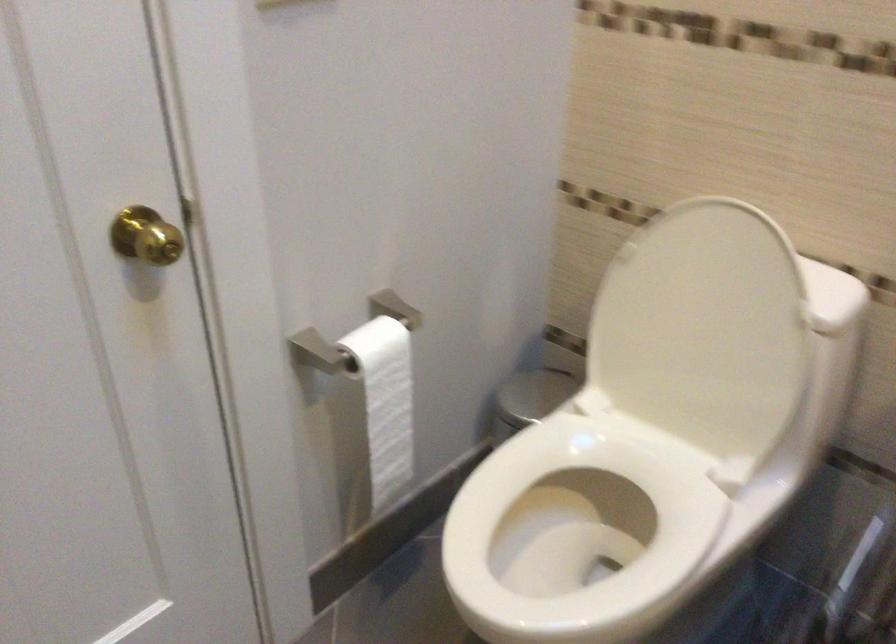
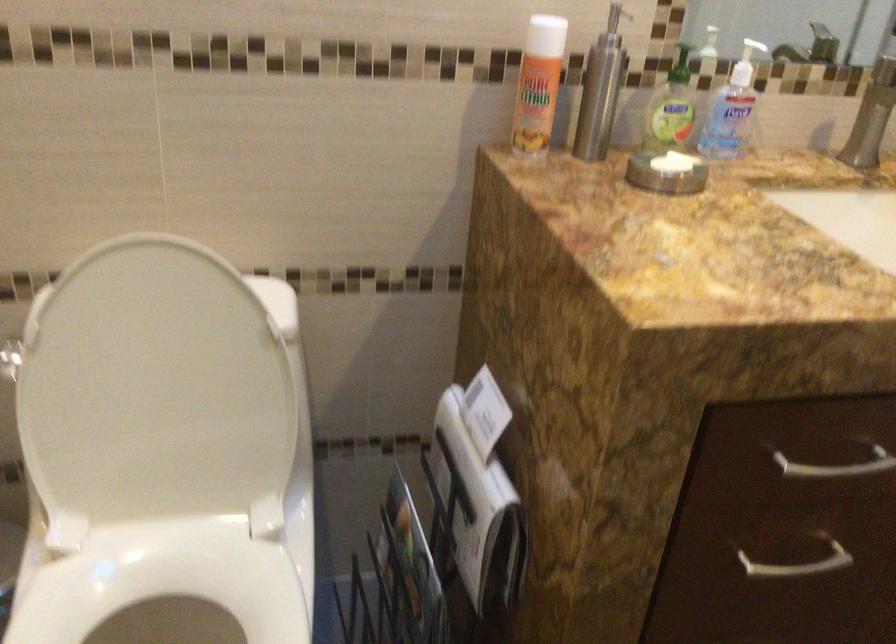
The point at (635, 491) is marked in the first image. Where is the corresponding point in the second image?

(166, 594)